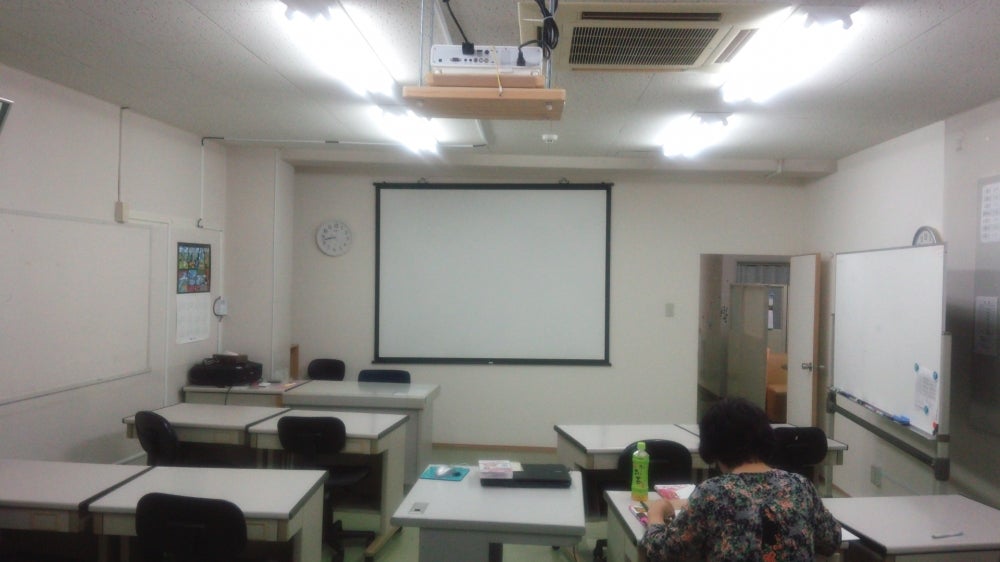
The width and height of the screenshot is (1000, 562). I want to click on light, so click(x=806, y=33), click(x=779, y=48), click(x=755, y=80), click(x=746, y=92), click(x=788, y=86).